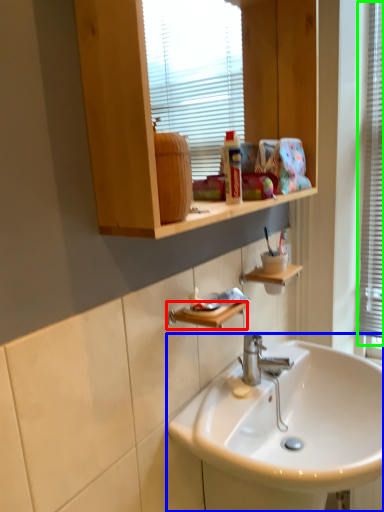
Question: Which object is the farthest from shelf (highlighted by a red box)? Choose among these: sink (highlighted by a blue box) or window frame (highlighted by a green box).

Choices:
 (A) sink
 (B) window frame

Answer: (B)